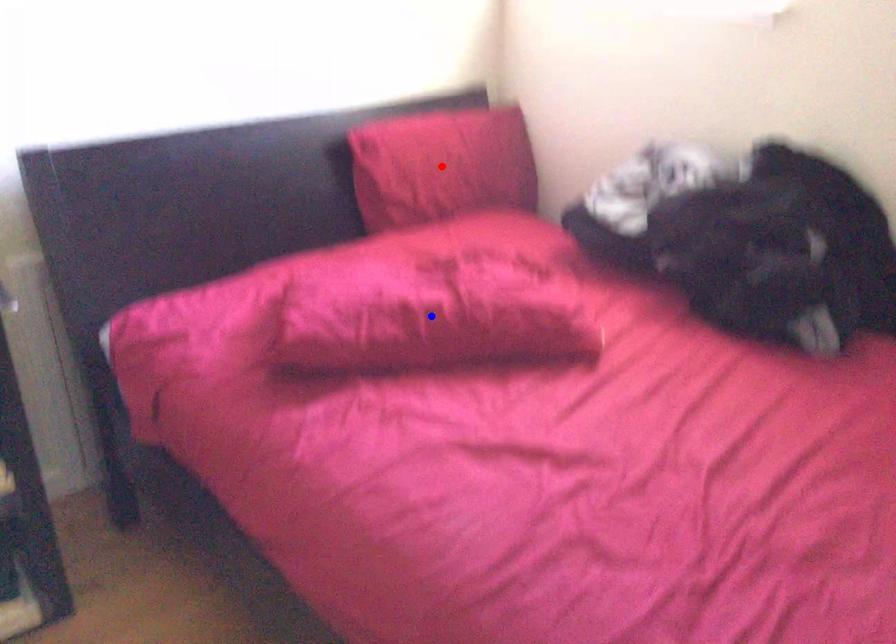
Question: Two points are marked on the image. Which point is closer to the camera?

Choices:
 (A) Blue point is closer.
 (B) Red point is closer.

Answer: (A)